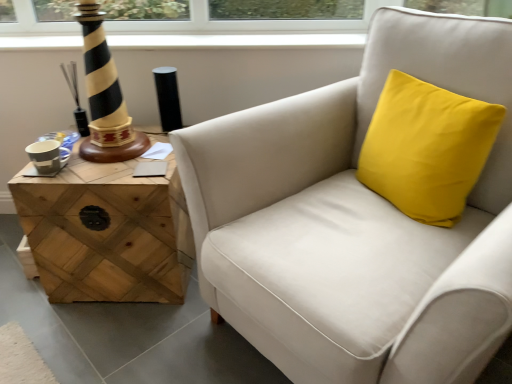
Question: Considering the relative positions of woodenmaterial/texturetable at left and yellow fabric cushion at upper right in the image provided, is woodenmaterial/texturetable at left to the left or to the right of yellow fabric cushion at upper right?

Choices:
 (A) left
 (B) right

Answer: (A)

Question: In the image, is woodenmaterial/texturetable at left positioned in front of or behind yellow fabric cushion at upper right?

Choices:
 (A) behind
 (B) front

Answer: (A)

Question: Which object is positioned closest to the yellow fabric cushion at upper right?

Choices:
 (A) woodenmaterial/texturetable at left
 (B) matte white armchair at center

Answer: (B)

Question: Which object is positioned farthest from the matte white armchair at center?

Choices:
 (A) yellow fabric cushion at upper right
 (B) woodenmaterial/texturetable at left

Answer: (B)